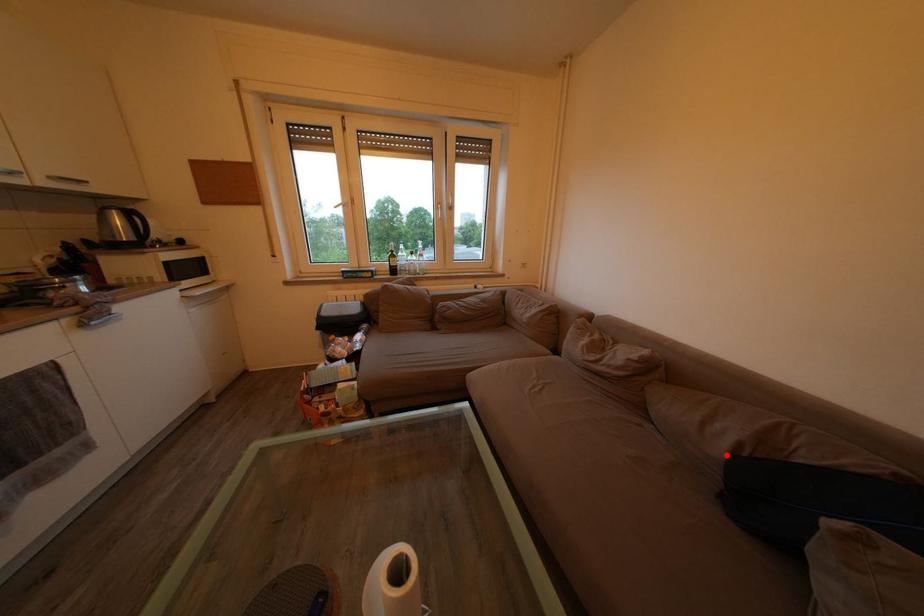
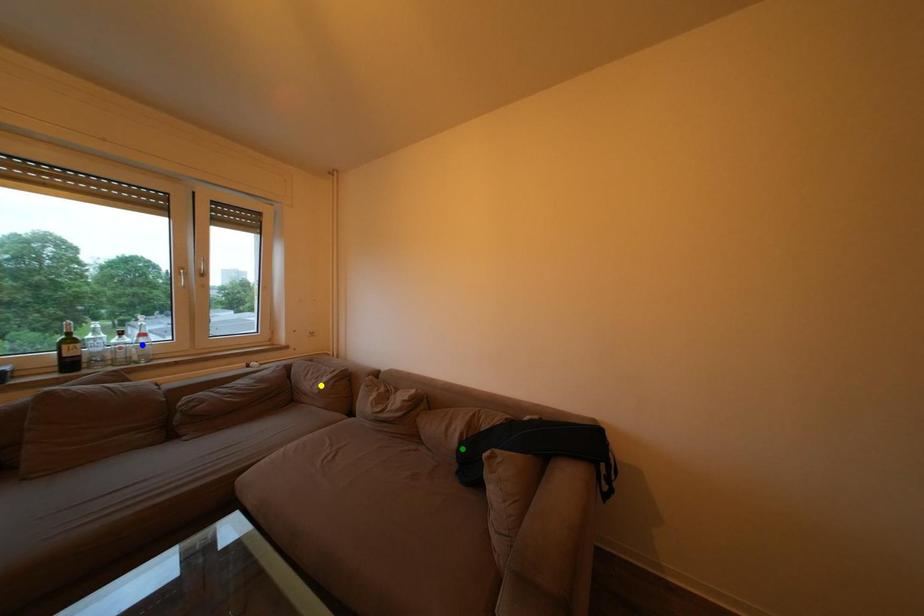
Question: I am providing you with two images of the same scene from different viewpoints. A red point is marked on the first image. You are given multiple points on the second image. Which point in image 2 is actually the same real-world point as the red point in image 1?

Choices:
 (A) yellow point
 (B) blue point
 (C) green point

Answer: (C)